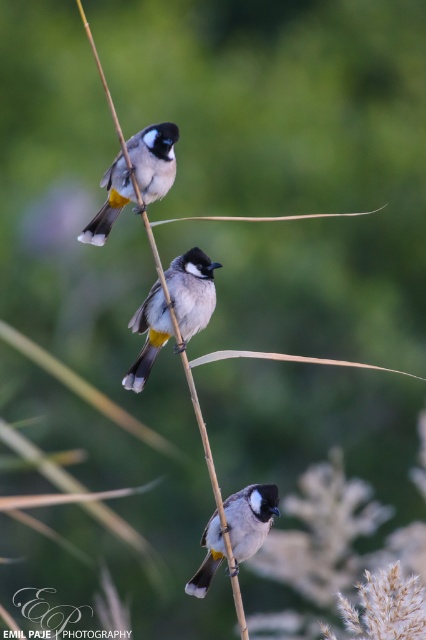
Does gray matte bird at center have a larger size compared to white matte bird at center?

Indeed, gray matte bird at center has a larger size compared to white matte bird at center.

Is gray matte bird at center positioned behind white matte bird at center?

Yes.

Who is more distant from viewer, (149, 292) or (253, 540)?

Point (149, 292)

The width and height of the screenshot is (426, 640). I want to click on gray matte bird at center, so click(190, 291).

Is white matte bird at upper center positioned before white matte bird at center?

That is False.

Is white matte bird at upper center bigger than white matte bird at center?

Indeed, white matte bird at upper center has a larger size compared to white matte bird at center.

Locate an element on the screen. white matte bird at upper center is located at coordinates (135, 177).

Does point (132, 388) come farther from viewer compared to point (137, 150)?

That is True.

Does gray matte bird at center have a smaller size compared to white matte bird at upper center?

No, gray matte bird at center is not smaller than white matte bird at upper center.

Is point (149, 328) positioned in front of point (78, 237)?

That is True.

This screenshot has height=640, width=426. Find the location of `gray matte bird at center`. gray matte bird at center is located at coordinates 190,291.